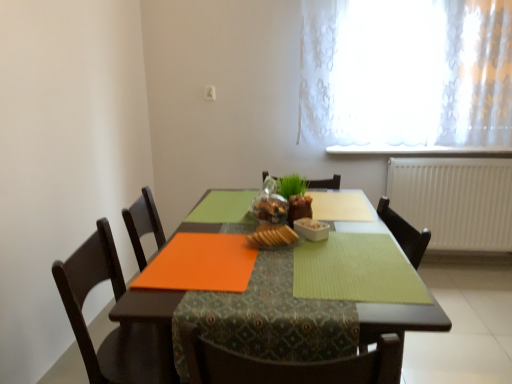
You are a GUI agent. You are given a task and a screenshot of the screen. Output one action in this format:
    pyautogui.click(x=<x>, y=<y>)
    Task: Click on the free spot to the right of white glossy bowl at center
    The image size is (512, 384).
    Given the screenshot: What is the action you would take?
    pyautogui.click(x=360, y=236)